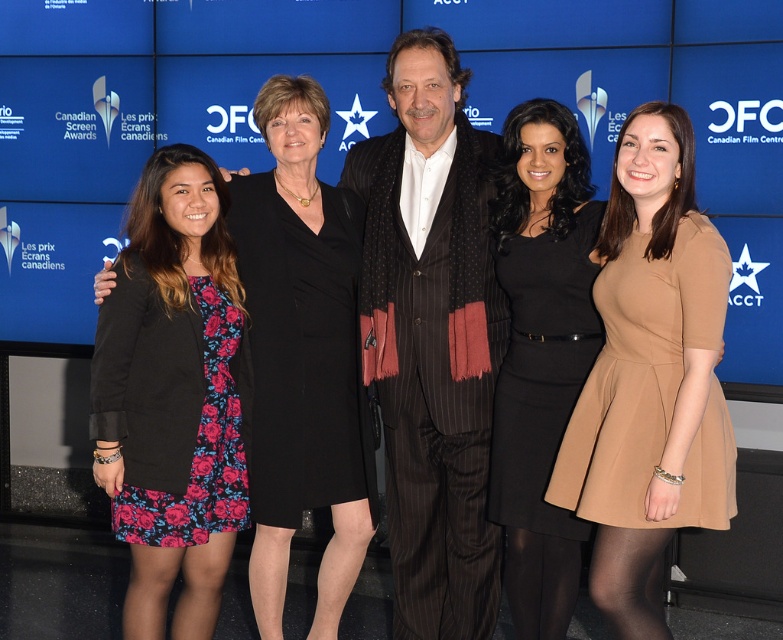
You are a photographer at the Canadian Film Centre event. You need to adjust the lighting to ensure both the matte beige dress at center and the floral dress at center are well lit. Since the dresses are different in size, which dress requires more light to be focused on it?

The matte beige dress at center is larger than the floral dress at center, so more light should be focused on the matte beige dress at center to ensure it is properly illuminated.

You are standing in front of the CFC event backdrop and want to take a photo. There are two points marked in the image at coordinates point [121,308] and point [538,257]. Which point is closer to you?

Point [121,308] is closer to you than point [538,257].